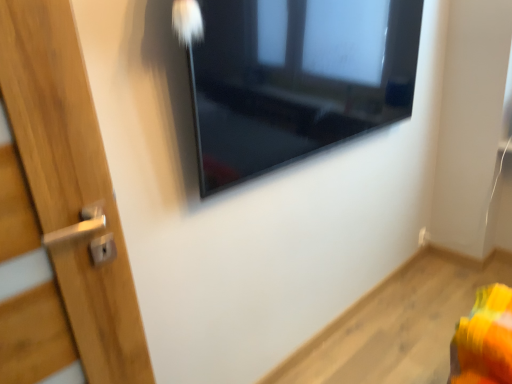
Question: From a real-world perspective, is glossy glass window at upper center physically located above or below white plastic electric outlet at lower right?

Choices:
 (A) below
 (B) above

Answer: (B)

Question: Considering the relative positions of glossy glass window at upper center and white plastic electric outlet at lower right in the image provided, is glossy glass window at upper center to the left or to the right of white plastic electric outlet at lower right?

Choices:
 (A) left
 (B) right

Answer: (A)

Question: Is glossy glass window at upper center taller or shorter than white plastic electric outlet at lower right?

Choices:
 (A) tall
 (B) short

Answer: (A)

Question: Considering the positions of white plastic electric outlet at lower right and glossy glass window at upper center in the image, is white plastic electric outlet at lower right bigger or smaller than glossy glass window at upper center?

Choices:
 (A) big
 (B) small

Answer: (B)

Question: From the image's perspective, is white plastic electric outlet at lower right located above or below glossy glass window at upper center?

Choices:
 (A) below
 (B) above

Answer: (A)

Question: In the image, is white plastic electric outlet at lower right on the left side or the right side of glossy glass window at upper center?

Choices:
 (A) right
 (B) left

Answer: (A)

Question: In terms of height, does white plastic electric outlet at lower right look taller or shorter compared to glossy glass window at upper center?

Choices:
 (A) short
 (B) tall

Answer: (A)